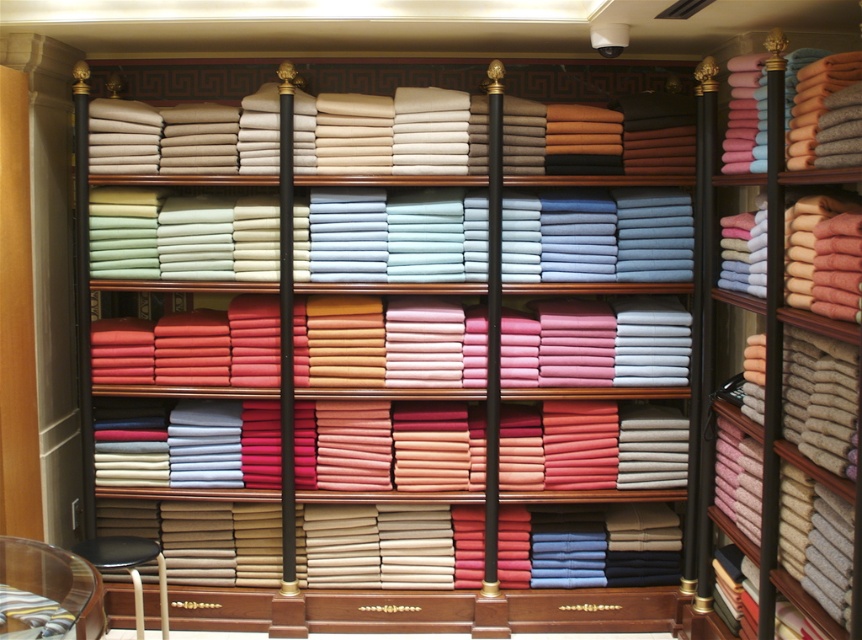
Based on the photo, you are a customer in the store and want to place a small item on the nearest available surface. You see the transparent glass table at lower left. Is there any object at point (x=53, y=582) that you can use as a surface?

Yes, the transparent glass table at lower left is located at point (x=53, y=582) and can be used as a surface.

You are a customer in the store and want to place a small bag on the transparent glass table at lower left. Can you do that without obstructing the view of the fabric display behind it?

Yes, because the transparent glass table at lower left is at point [53,582], which is positioned in a way that placing a small bag there would not block the view of the fabric display behind it.

You are a customer in a fabric store and want to locate the soft woolen towels at right. According to the store layout, where should you look?

The soft woolen towels at right are located at point (767, 212).